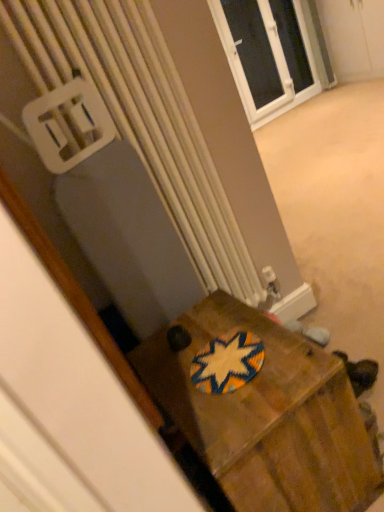
At what (x,y) coordinates should I click in order to perform the action: click on empty space that is ontop of wooden box at center (from a real-world perspective). Please return your answer as a coordinate pair (x, y). Looking at the image, I should click on (221, 359).